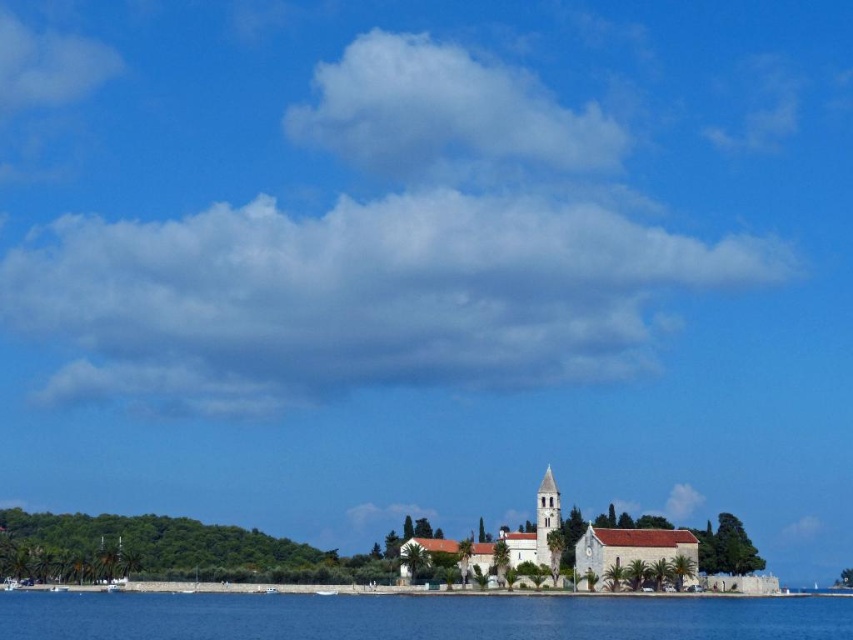
You are standing on the shore looking towards the island. Based on the scene, which object is closer to you between the blue water at lower center and the white stone spire at center?

The blue water at lower center is closer to you because it is in front of the white stone spire at center.

You are standing on the shore of the island and looking out at the scene. Which object, the blue water at lower center or the white stone church at center, appears taller from your perspective?

The white stone church at center appears taller because the blue water at lower center is shorter than it.